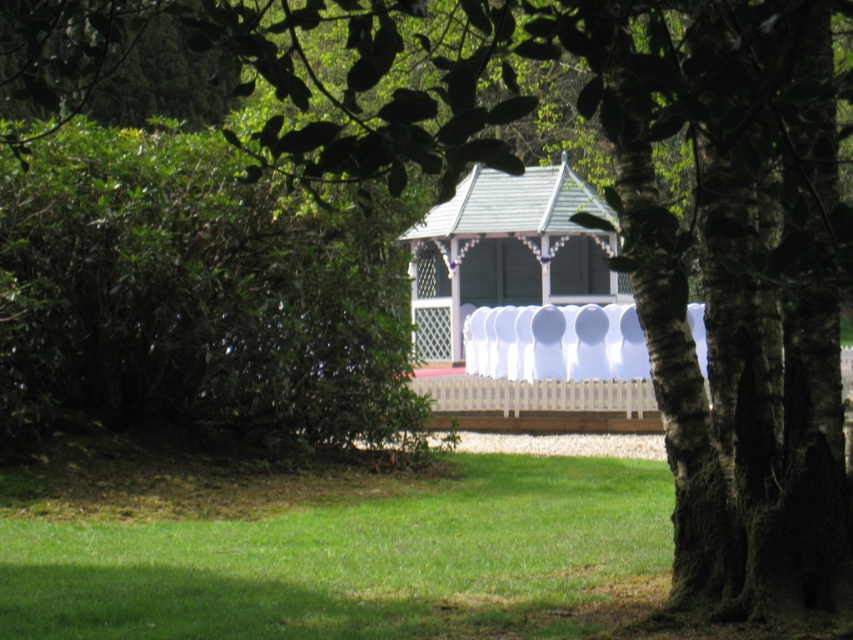
Does point (123, 554) come behind point (527, 392)?

No, it is not.

Which of these two, green grass at lower center or white wood gazebo at center, stands taller?

Standing taller between the two is white wood gazebo at center.

Does point (175, 618) come in front of point (563, 374)?

That is True.

Where is `green grass at lower center`? Image resolution: width=853 pixels, height=640 pixels. green grass at lower center is located at coordinates (358, 561).